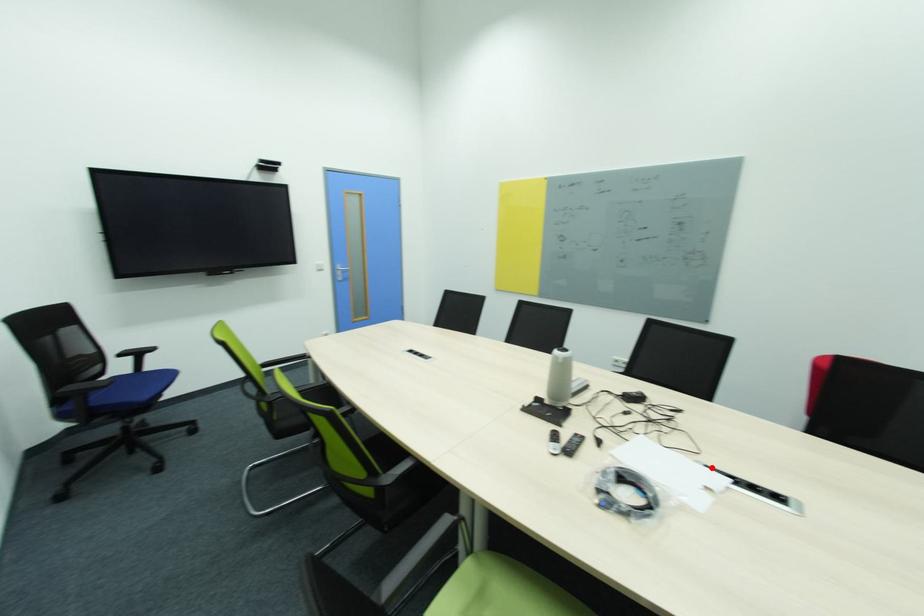
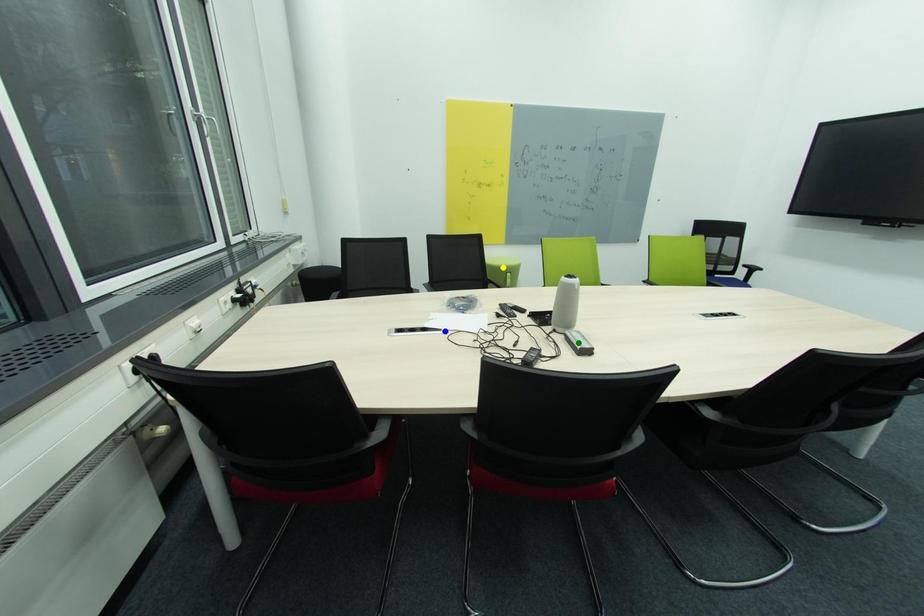
Question: I am providing you with two images of the same scene from different viewpoints. A red point is marked on the first image. You are given multiple points on the second image. Can you choose the point in image 2 that corresponds to the point in image 1?

Choices:
 (A) green point
 (B) blue point
 (C) yellow point

Answer: (B)